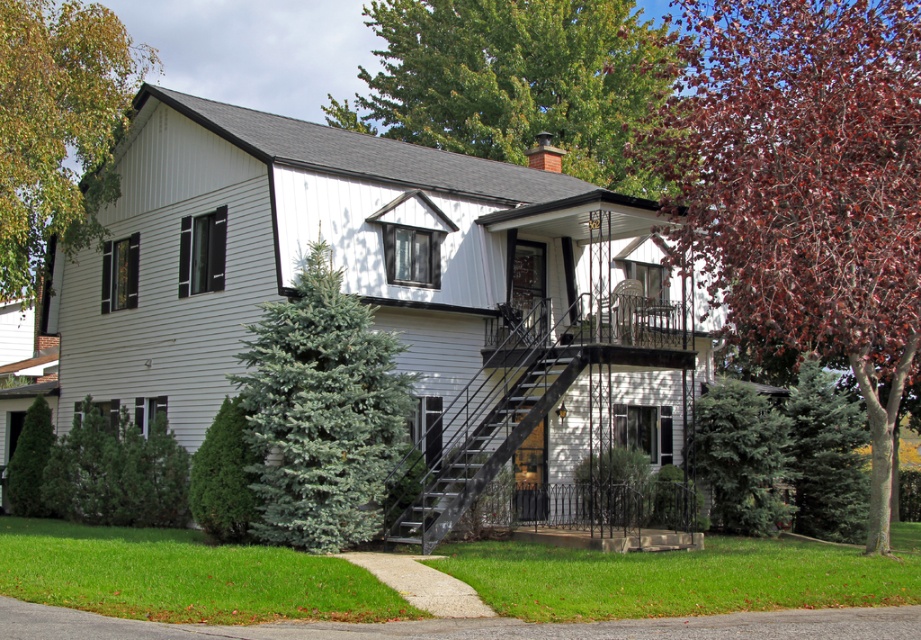
From the picture: Does reddish-brown bark tree at upper right appear under green leafy tree at upper left?

Indeed, reddish-brown bark tree at upper right is positioned under green leafy tree at upper left.

Can you confirm if reddish-brown bark tree at upper right is smaller than green leafy tree at upper left?

Correct, reddish-brown bark tree at upper right occupies less space than green leafy tree at upper left.

Where is `reddish-brown bark tree at upper right`? Image resolution: width=921 pixels, height=640 pixels. reddish-brown bark tree at upper right is located at coordinates (802, 188).

The width and height of the screenshot is (921, 640). I want to click on reddish-brown bark tree at upper right, so (802, 188).

This screenshot has height=640, width=921. I want to click on reddish-brown bark tree at upper right, so (x=802, y=188).

Is green leafy tree at upper center behind green fir tree at lower right?

Yes, green leafy tree at upper center is further from the viewer.

This screenshot has width=921, height=640. Find the location of `green leafy tree at upper center`. green leafy tree at upper center is located at coordinates (515, 81).

Locate an element on the screen. This screenshot has width=921, height=640. green leafy tree at upper center is located at coordinates (515, 81).